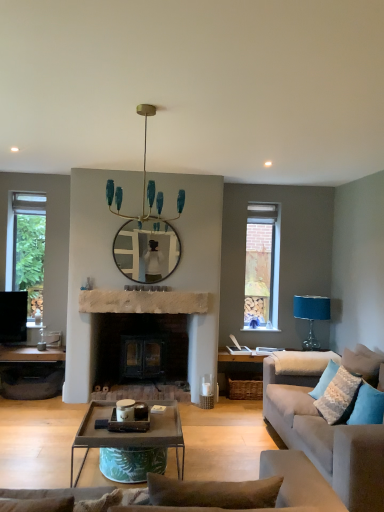
Question: Is blue fabric pillow at lower right, marked as the first pillow in a front-to-back arrangement, next to matte glass mirror at center?

Choices:
 (A) yes
 (B) no

Answer: (B)

Question: From the image's perspective, is blue fabric pillow at lower right, marked as the first pillow in a front-to-back arrangement, above matte glass mirror at center?

Choices:
 (A) yes
 (B) no

Answer: (B)

Question: Is matte glass mirror at center surrounded by blue fabric pillow at lower right, marked as the first pillow in a front-to-back arrangement?

Choices:
 (A) no
 (B) yes

Answer: (A)

Question: Is blue fabric pillow at lower right, placed as the 2th pillow when sorted from back to front, to the right of matte glass mirror at center from the viewer's perspective?

Choices:
 (A) yes
 (B) no

Answer: (A)

Question: Considering the relative sizes of blue fabric pillow at lower right, placed as the 2th pillow when sorted from back to front, and matte glass mirror at center in the image provided, is blue fabric pillow at lower right, placed as the 2th pillow when sorted from back to front, taller than matte glass mirror at center?

Choices:
 (A) no
 (B) yes

Answer: (A)

Question: In terms of size, does light gray fabric couch at right appear bigger or smaller than matte glass mirror at center?

Choices:
 (A) big
 (B) small

Answer: (A)

Question: Considering the positions of light gray fabric couch at right and matte glass mirror at center in the image, is light gray fabric couch at right wider or thinner than matte glass mirror at center?

Choices:
 (A) wide
 (B) thin

Answer: (A)

Question: From a real-world perspective, relative to matte glass mirror at center, is light gray fabric couch at right vertically above or below?

Choices:
 (A) above
 (B) below

Answer: (B)

Question: From their relative heights in the image, would you say light gray fabric couch at right is taller or shorter than matte glass mirror at center?

Choices:
 (A) short
 (B) tall

Answer: (B)

Question: In the image, is metallic gray coffee table at center positioned in front of or behind metallic silver tray at lower left?

Choices:
 (A) front
 (B) behind

Answer: (A)

Question: From a real-world perspective, is metallic gray coffee table at center above or below metallic silver tray at lower left?

Choices:
 (A) above
 (B) below

Answer: (A)

Question: Looking at their shapes, would you say metallic gray coffee table at center is wider or thinner than metallic silver tray at lower left?

Choices:
 (A) thin
 (B) wide

Answer: (B)

Question: Considering the positions of point (160, 401) and point (51, 355), is point (160, 401) closer or farther from the camera than point (51, 355)?

Choices:
 (A) farther
 (B) closer

Answer: (B)

Question: Is blue fabric pillow at lower right, marked as the first pillow in a front-to-back arrangement, inside or outside of metallic silver tray at lower left?

Choices:
 (A) inside
 (B) outside

Answer: (B)

Question: From a real-world perspective, is blue fabric pillow at lower right, marked as the first pillow in a front-to-back arrangement, physically located above or below metallic silver tray at lower left?

Choices:
 (A) below
 (B) above

Answer: (B)